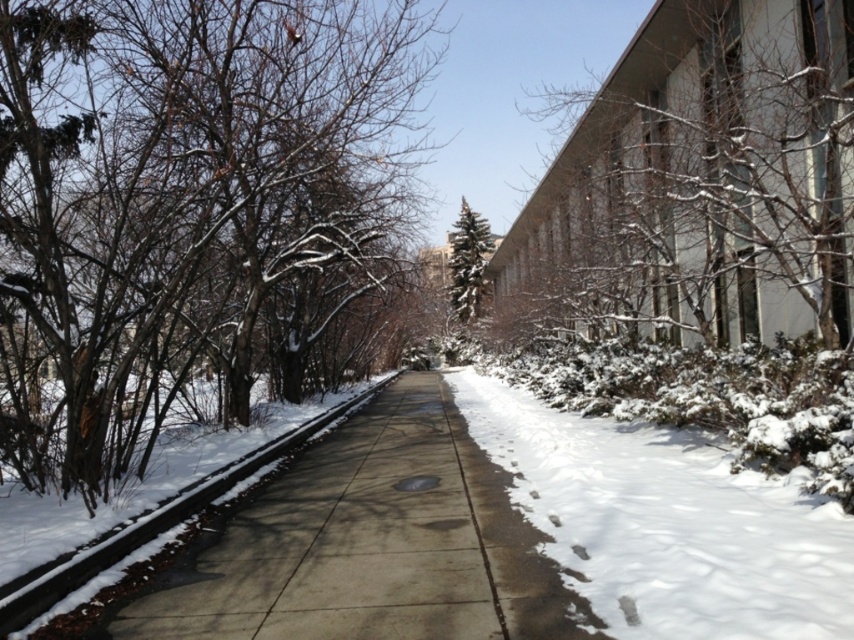
Who is positioned more to the right, snow-covered branches at left or white fluffy snow at center?

white fluffy snow at center is more to the right.

Is point (79, 344) farther from viewer compared to point (670, 502)?

Yes, point (79, 344) is farther from viewer.

Who is more forward, (12, 305) or (700, 541)?

Point (700, 541) is in front.

This screenshot has height=640, width=854. I want to click on snow-covered branches at left, so click(x=183, y=202).

Can you confirm if white fluffy snow at center is positioned to the left of green textured evergreen tree at center?

Correct, you'll find white fluffy snow at center to the left of green textured evergreen tree at center.

Can you confirm if white fluffy snow at center is positioned above green textured evergreen tree at center?

No.

Is point (692, 548) positioned in front of point (463, 212)?

Yes, it is.

At what (x,y) coordinates should I click in order to perform the action: click on white fluffy snow at center. Please return your answer as a coordinate pair (x, y). Image resolution: width=854 pixels, height=640 pixels. Looking at the image, I should click on (665, 522).

This screenshot has width=854, height=640. I want to click on snow-covered branches at left, so click(183, 202).

Based on the photo, can you confirm if snow-covered branches at left is wider than green textured evergreen tree at center?

Yes.

In order to click on snow-covered branches at left in this screenshot , I will do `click(183, 202)`.